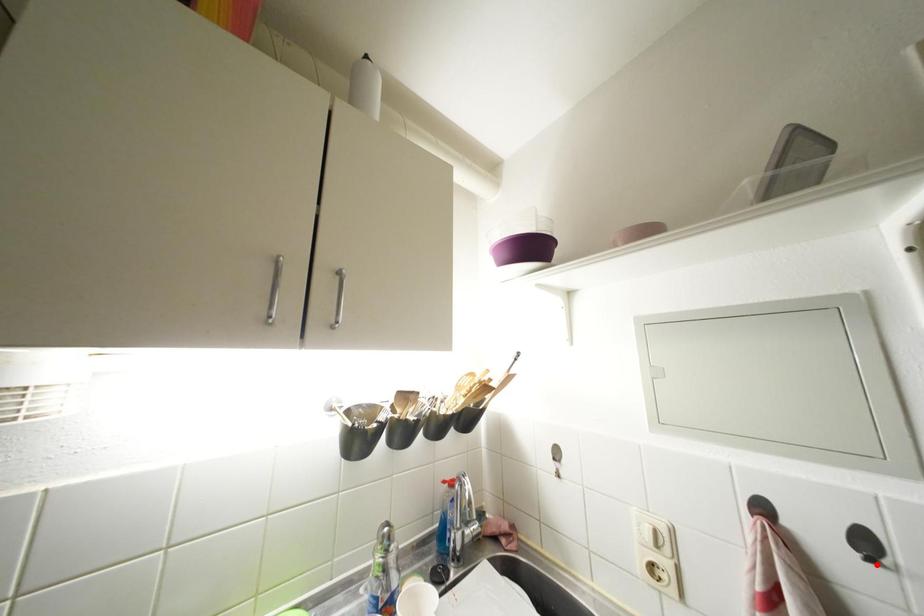
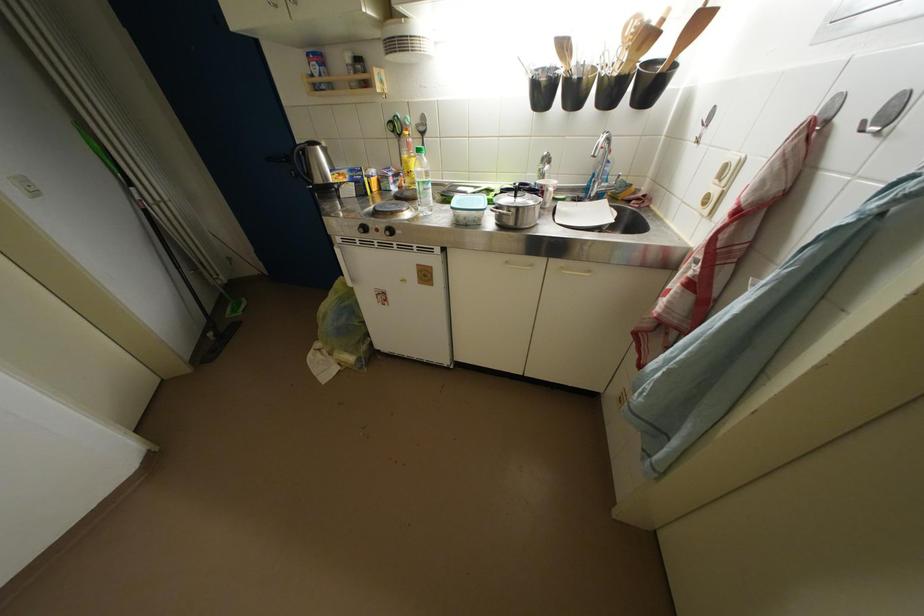
Where in the second image is the point corresponding to the highlighted location from the first image?

(869, 132)